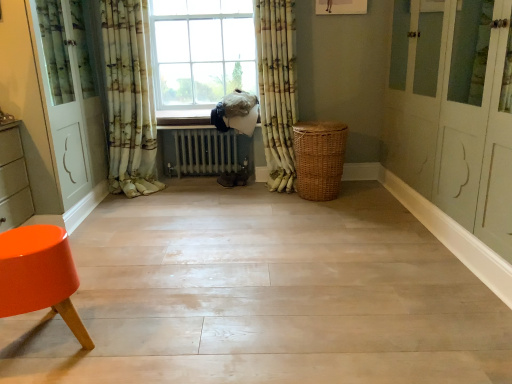
You are a GUI agent. You are given a task and a screenshot of the screen. Output one action in this format:
    pyautogui.click(x=<x>, y=<y>)
    Task: Click on the woven brown basket at center
    The image size is (512, 384).
    Given the screenshot: What is the action you would take?
    pyautogui.click(x=319, y=159)

This screenshot has width=512, height=384. What do you see at coordinates (319, 159) in the screenshot?
I see `woven brown basket at center` at bounding box center [319, 159].

Describe the element at coordinates (39, 275) in the screenshot. This screenshot has height=384, width=512. I see `orange glossy stool at lower left` at that location.

I want to click on floral fabric curtain at center, which is counted as the second curtain, starting from the left, so click(129, 98).

At what (x,y) coordinates should I click in order to perform the action: click on green floral fabric curtain at left, marked as the 1th curtain in a left-to-right arrangement. Please return your answer as a coordinate pair (x, y). Looking at the image, I should click on (70, 98).

Is white metallic radiator at center outside of wooden at center?

Yes, white metallic radiator at center is not within wooden at center.

Which of these two, white metallic radiator at center or wooden at center, stands shorter?

With less height is wooden at center.

Is white metallic radiator at center aimed at wooden at center?

No, white metallic radiator at center is not turned towards wooden at center.

Which is behind, point (8, 304) or point (347, 127)?

Point (347, 127)

Is orange glossy stool at lower left facing towards woven brown basket at center?

No, orange glossy stool at lower left is not aimed at woven brown basket at center.

Where is `chair in front of the woven brown basket at center`? chair in front of the woven brown basket at center is located at coordinates (39, 275).

From the image's perspective, between patterned fabric curtain at center, which is counted as the 1th curtain, starting from the right, and white metallic radiator at center, who is located below?

white metallic radiator at center appears lower in the image.

Where is `radiator behind the patterned fabric curtain at center, which is counted as the 1th curtain, starting from the right`? This screenshot has height=384, width=512. radiator behind the patterned fabric curtain at center, which is counted as the 1th curtain, starting from the right is located at coordinates (205, 151).

Which is behind, point (279, 180) or point (197, 135)?

Positioned behind is point (197, 135).

Is patterned fabric curtain at center, acting as the third curtain starting from the left, positioned beyond the bounds of white metallic radiator at center?

Yes.

Considering the sizes of objects wooden at center and floral fabric curtain at center, which is counted as the second curtain, starting from the left, in the image provided, who is taller, wooden at center or floral fabric curtain at center, which is counted as the second curtain, starting from the left,?

With more height is floral fabric curtain at center, which is counted as the second curtain, starting from the left.

Is the depth of wooden at center less than that of floral fabric curtain at center, which is counted as the second curtain, starting from the left?

No.

Which is in front, point (206, 117) or point (139, 63)?

Point (139, 63)

Based on the photo, is wooden at center to the left or to the right of floral fabric curtain at center, which is counted as the second curtain, starting from the left, in the image?

wooden at center is positioned on floral fabric curtain at center, which is counted as the second curtain, starting from the left,'s right side.

Is orange glossy stool at lower left a part of green floral fabric curtain at left, marked as the 1th curtain in a left-to-right arrangement?

Definitely not — orange glossy stool at lower left is not inside green floral fabric curtain at left, marked as the 1th curtain in a left-to-right arrangement.

The width and height of the screenshot is (512, 384). In order to click on chair on the right of green floral fabric curtain at left, which appears as the 3th curtain when viewed from the right in this screenshot , I will do `click(39, 275)`.

Considering the sizes of objects green floral fabric curtain at left, marked as the 1th curtain in a left-to-right arrangement, and orange glossy stool at lower left in the image provided, who is bigger, green floral fabric curtain at left, marked as the 1th curtain in a left-to-right arrangement, or orange glossy stool at lower left?

green floral fabric curtain at left, marked as the 1th curtain in a left-to-right arrangement.

From the image's perspective, is woven brown basket at center located above or below green floral fabric curtain at left, marked as the 1th curtain in a left-to-right arrangement?

From the image's perspective, woven brown basket at center appears below green floral fabric curtain at left, marked as the 1th curtain in a left-to-right arrangement.

Considering the sizes of woven brown basket at center and green floral fabric curtain at left, marked as the 1th curtain in a left-to-right arrangement, in the image, is woven brown basket at center wider or thinner than green floral fabric curtain at left, marked as the 1th curtain in a left-to-right arrangement,?

In the image, woven brown basket at center appears to be more narrow than green floral fabric curtain at left, marked as the 1th curtain in a left-to-right arrangement.

Can you confirm if woven brown basket at center is positioned to the right of green floral fabric curtain at left, marked as the 1th curtain in a left-to-right arrangement?

Correct, you'll find woven brown basket at center to the right of green floral fabric curtain at left, marked as the 1th curtain in a left-to-right arrangement.

From their relative heights in the image, would you say woven brown basket at center is taller or shorter than green floral fabric curtain at left, marked as the 1th curtain in a left-to-right arrangement?

Considering their sizes, woven brown basket at center has less height than green floral fabric curtain at left, marked as the 1th curtain in a left-to-right arrangement.

Who is smaller, orange glossy stool at lower left or floral fabric curtain at center, acting as the second curtain starting from the right?

orange glossy stool at lower left.

Between point (74, 276) and point (142, 34), which one is positioned in front?

The point (74, 276) is closer to the camera.

From a real-world perspective, is orange glossy stool at lower left on floral fabric curtain at center, which is counted as the second curtain, starting from the left?

No, from a real-world perspective, orange glossy stool at lower left is not on top of floral fabric curtain at center, which is counted as the second curtain, starting from the left.

Is orange glossy stool at lower left oriented away from floral fabric curtain at center, which is counted as the second curtain, starting from the left?

No.

Where is `window sill in front of the white metallic radiator at center`? The width and height of the screenshot is (512, 384). window sill in front of the white metallic radiator at center is located at coordinates (183, 121).

This screenshot has width=512, height=384. What are the coordinates of `basket located on the right of orange glossy stool at lower left` in the screenshot? It's located at (319, 159).

Estimate the real-world distances between objects in this image. Which object is closer to floral fabric curtain at center, acting as the second curtain starting from the right, green floral fabric curtain at left, which appears as the 3th curtain when viewed from the right, or wooden at center?

green floral fabric curtain at left, which appears as the 3th curtain when viewed from the right, lies closer to floral fabric curtain at center, acting as the second curtain starting from the right, than the other object.

When comparing their distances from white metallic radiator at center, does woven brown basket at center or patterned fabric curtain at center, acting as the third curtain starting from the left, seem further?

woven brown basket at center is further to white metallic radiator at center.

When comparing their distances from green floral fabric curtain at left, marked as the 1th curtain in a left-to-right arrangement, does floral fabric curtain at center, which is counted as the second curtain, starting from the left, or patterned fabric curtain at center, acting as the third curtain starting from the left, seem closer?

floral fabric curtain at center, which is counted as the second curtain, starting from the left, is closer to green floral fabric curtain at left, marked as the 1th curtain in a left-to-right arrangement.

Which object lies nearer to the anchor point white metallic radiator at center, patterned fabric curtain at center, acting as the third curtain starting from the left, or green floral fabric curtain at left, which appears as the 3th curtain when viewed from the right?

patterned fabric curtain at center, acting as the third curtain starting from the left, lies closer to white metallic radiator at center than the other object.

Considering their positions, is patterned fabric curtain at center, acting as the third curtain starting from the left, positioned further to white metallic radiator at center than woven brown basket at center?

woven brown basket at center lies further to white metallic radiator at center than the other object.

Looking at the image, which one is located further to floral fabric curtain at center, acting as the second curtain starting from the right, woven brown basket at center or green floral fabric curtain at left, marked as the 1th curtain in a left-to-right arrangement?

The object further to floral fabric curtain at center, acting as the second curtain starting from the right, is woven brown basket at center.

Based on their spatial positions, is floral fabric curtain at center, which is counted as the second curtain, starting from the left, or green floral fabric curtain at left, which appears as the 3th curtain when viewed from the right, further from patterned fabric curtain at center, acting as the third curtain starting from the left?

Based on the image, green floral fabric curtain at left, which appears as the 3th curtain when viewed from the right, appears to be further to patterned fabric curtain at center, acting as the third curtain starting from the left.

Considering their positions, is orange glossy stool at lower left positioned closer to green floral fabric curtain at left, which appears as the 3th curtain when viewed from the right, than floral fabric curtain at center, which is counted as the second curtain, starting from the left?

floral fabric curtain at center, which is counted as the second curtain, starting from the left, is positioned closer to the anchor green floral fabric curtain at left, which appears as the 3th curtain when viewed from the right.

You are a GUI agent. You are given a task and a screenshot of the screen. Output one action in this format:
    pyautogui.click(x=<x>, y=<y>)
    Task: Click on the basket between orange glossy stool at lower left and wooden at center in the front-back direction
    This screenshot has width=512, height=384.
    Given the screenshot: What is the action you would take?
    pyautogui.click(x=319, y=159)

The width and height of the screenshot is (512, 384). What are the coordinates of `radiator between floral fabric curtain at center, acting as the second curtain starting from the right, and woven brown basket at center, in the horizontal direction` in the screenshot? It's located at (205, 151).

I want to click on window sill between orange glossy stool at lower left and white metallic radiator at center along the z-axis, so click(183, 121).

This screenshot has width=512, height=384. Find the location of `basket located between orange glossy stool at lower left and white metallic radiator at center in the depth direction`. basket located between orange glossy stool at lower left and white metallic radiator at center in the depth direction is located at coordinates (319, 159).